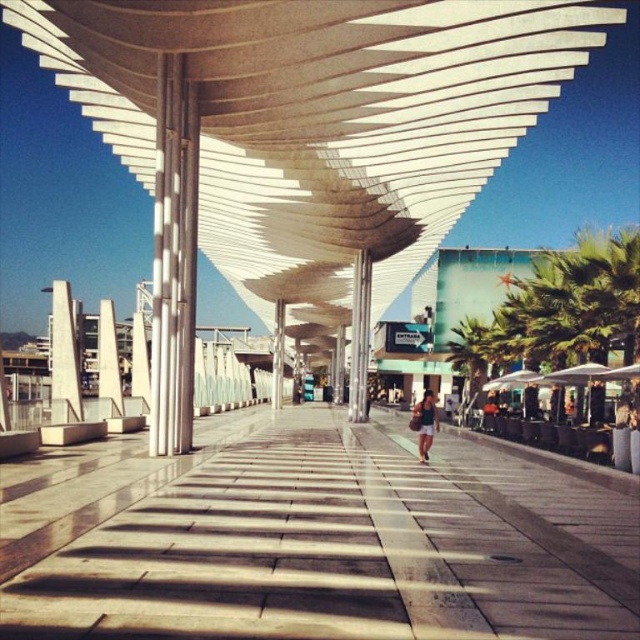
Does point (225, 518) lie behind point (422, 456)?

No, it is not.

Does point (35, 572) lie in front of point (429, 410)?

Yes.

You are a GUI agent. You are given a task and a screenshot of the screen. Output one action in this format:
    pyautogui.click(x=<x>, y=<y>)
    Task: Click on the white polished stone pavement at center
    The width and height of the screenshot is (640, 640).
    Given the screenshot: What is the action you would take?
    pyautogui.click(x=310, y=538)